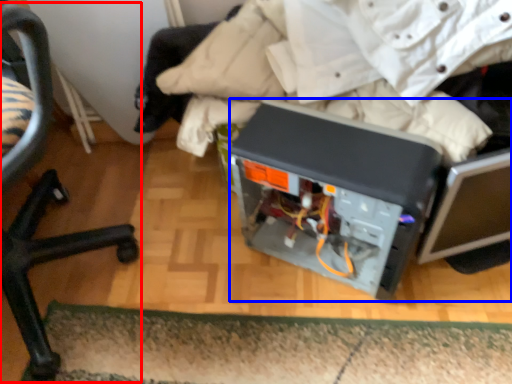
Question: Which object is further to the camera taking this photo, chair (highlighted by a red box) or wide (highlighted by a blue box)?

Choices:
 (A) chair
 (B) wide

Answer: (B)